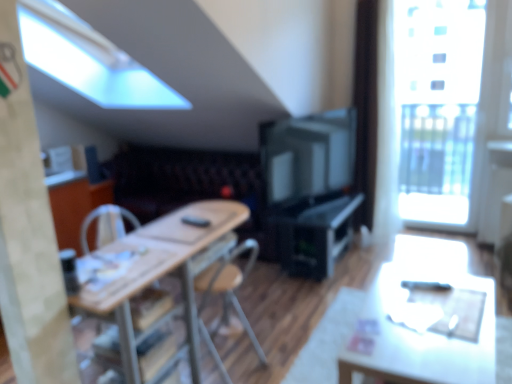
Question: Is wooden table at center positioned before black plastic remote control at center?

Choices:
 (A) yes
 (B) no

Answer: (A)

Question: Are wooden table at center and black plastic remote control at center far apart?

Choices:
 (A) yes
 (B) no

Answer: (B)

Question: Does wooden table at center turn towards black plastic remote control at center?

Choices:
 (A) yes
 (B) no

Answer: (A)

Question: Considering the relative positions of wooden table at center and black plastic remote control at center in the image provided, is wooden table at center to the left of black plastic remote control at center from the viewer's perspective?

Choices:
 (A) yes
 (B) no

Answer: (A)

Question: From the image's perspective, is wooden table at center located above black plastic remote control at center?

Choices:
 (A) yes
 (B) no

Answer: (B)

Question: Considering the relative positions of wooden table at center and black plastic remote control at center in the image provided, is wooden table at center behind black plastic remote control at center?

Choices:
 (A) no
 (B) yes

Answer: (A)

Question: Can you confirm if matte black television at center is wider than black plastic remote control at center?

Choices:
 (A) yes
 (B) no

Answer: (B)

Question: Is matte black television at center shorter than black plastic remote control at center?

Choices:
 (A) yes
 (B) no

Answer: (B)

Question: Is matte black television at center smaller than black plastic remote control at center?

Choices:
 (A) yes
 (B) no

Answer: (B)

Question: Considering the relative sizes of matte black television at center and black plastic remote control at center in the image provided, is matte black television at center bigger than black plastic remote control at center?

Choices:
 (A) yes
 (B) no

Answer: (A)

Question: From the image's perspective, is matte black television at center located beneath black plastic remote control at center?

Choices:
 (A) yes
 (B) no

Answer: (B)

Question: Is matte black television at center at the right side of black plastic remote control at center?

Choices:
 (A) yes
 (B) no

Answer: (A)

Question: Can you confirm if black plastic computer desk at center is taller than transparent glass window at upper right?

Choices:
 (A) no
 (B) yes

Answer: (A)